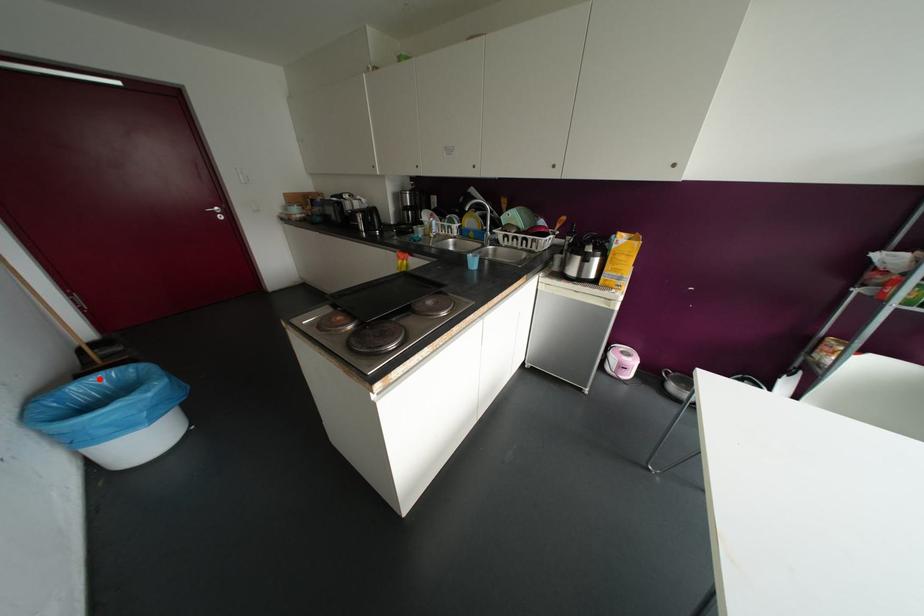
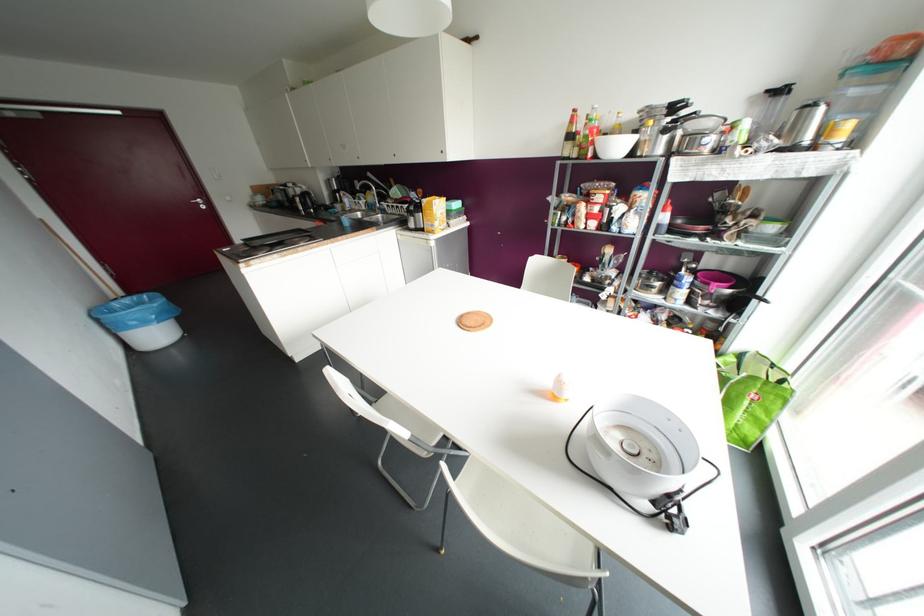
Question: I am providing you with two images of the same scene from different viewpoints. A red point is shown in image1. For the corresponding object point in image2, is it positioned nearer or farther from the camera?

Choices:
 (A) Nearer
 (B) Farther

Answer: (A)